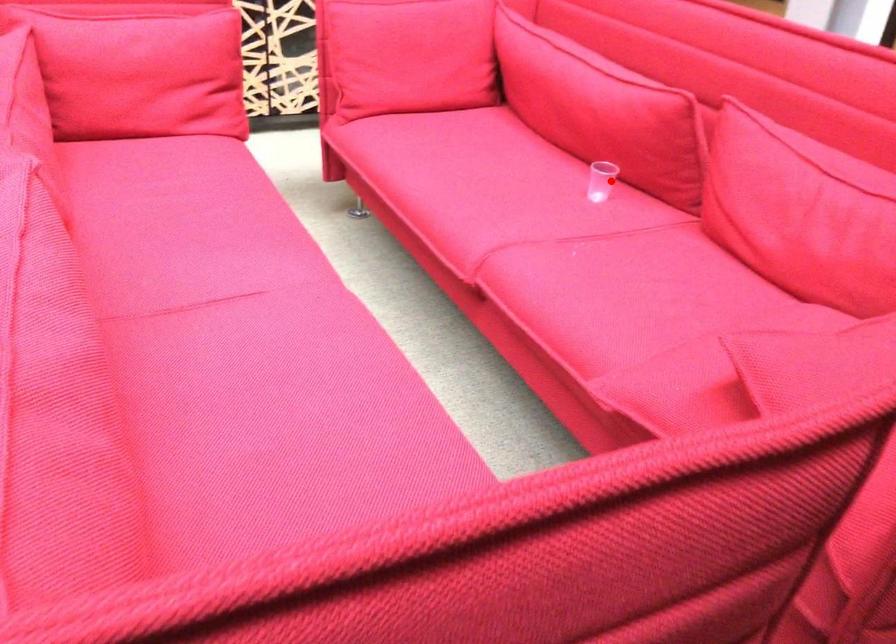
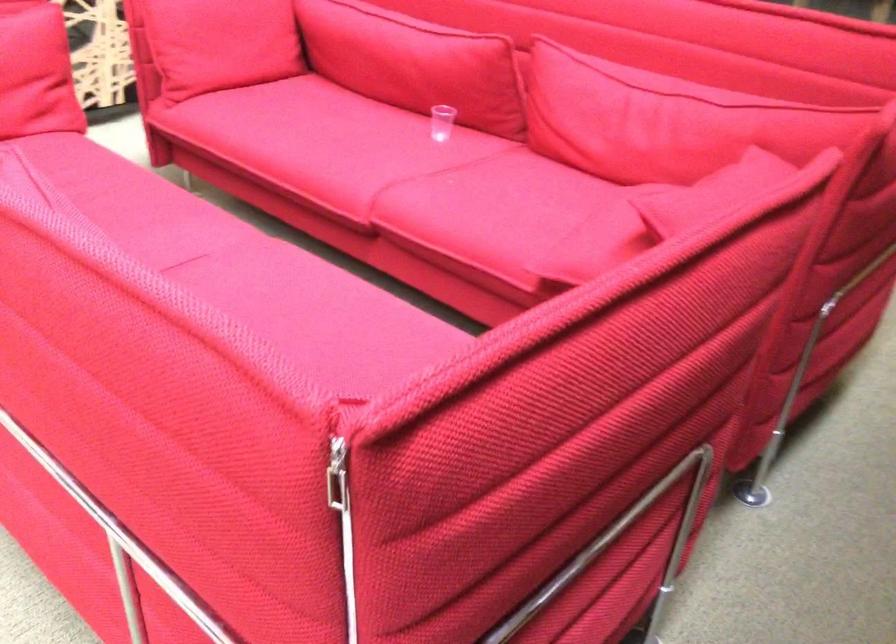
The point at the highlighted location is marked in the first image. Where is the corresponding point in the second image?

(442, 122)